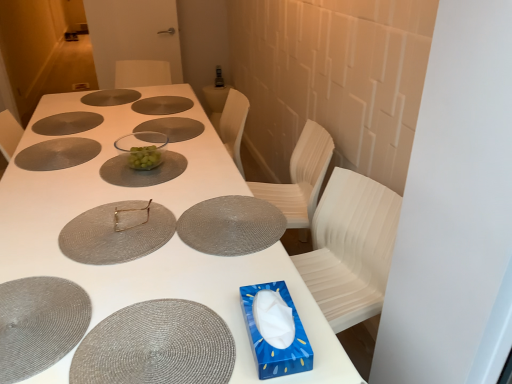
The width and height of the screenshot is (512, 384). What are the coordinates of `vacant space that's between matte gray placemat at lower center, the ninth glass plate from the back, and transparent glass bowl at center` in the screenshot? It's located at (175, 225).